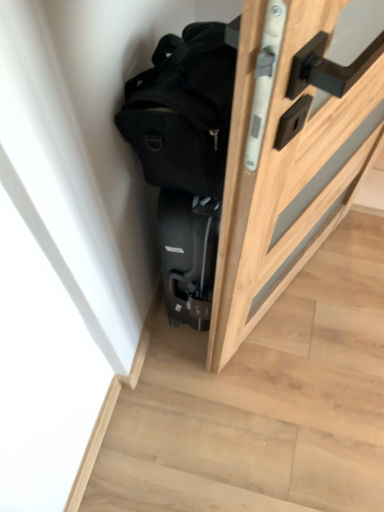
Question: Is wooden door at right placed right next to black matte backpack at upper center?

Choices:
 (A) yes
 (B) no

Answer: (B)

Question: Considering the relative sizes of wooden door at right and black matte backpack at upper center in the image provided, is wooden door at right taller than black matte backpack at upper center?

Choices:
 (A) yes
 (B) no

Answer: (A)

Question: From the image's perspective, is wooden door at right above black matte backpack at upper center?

Choices:
 (A) yes
 (B) no

Answer: (B)

Question: Is wooden door at right behind black matte backpack at upper center?

Choices:
 (A) yes
 (B) no

Answer: (A)

Question: Is wooden door at right smaller than black matte backpack at upper center?

Choices:
 (A) no
 (B) yes

Answer: (A)

Question: Considering the relative positions of wooden door at right and black matte backpack at upper center in the image provided, is wooden door at right in front of black matte backpack at upper center?

Choices:
 (A) yes
 (B) no

Answer: (B)

Question: Could you tell me if wooden door at right is turned towards black suitcase at lower left?

Choices:
 (A) no
 (B) yes

Answer: (A)

Question: Does wooden door at right have a lesser height compared to black suitcase at lower left?

Choices:
 (A) yes
 (B) no

Answer: (B)

Question: Can you confirm if wooden door at right is wider than black suitcase at lower left?

Choices:
 (A) yes
 (B) no

Answer: (B)

Question: From a real-world perspective, is wooden door at right below black suitcase at lower left?

Choices:
 (A) yes
 (B) no

Answer: (B)

Question: Is wooden door at right at the right side of black suitcase at lower left?

Choices:
 (A) yes
 (B) no

Answer: (A)

Question: Does wooden door at right appear on the left side of black suitcase at lower left?

Choices:
 (A) yes
 (B) no

Answer: (B)

Question: Does black suitcase at lower left appear on the left side of wooden door at right?

Choices:
 (A) no
 (B) yes

Answer: (B)